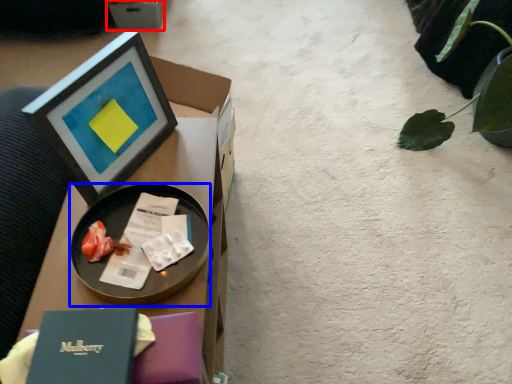
Question: Which of the following is the closest to the observer, cardboard box (highlighted by a red box) or tableware (highlighted by a blue box)?

Choices:
 (A) cardboard box
 (B) tableware

Answer: (B)